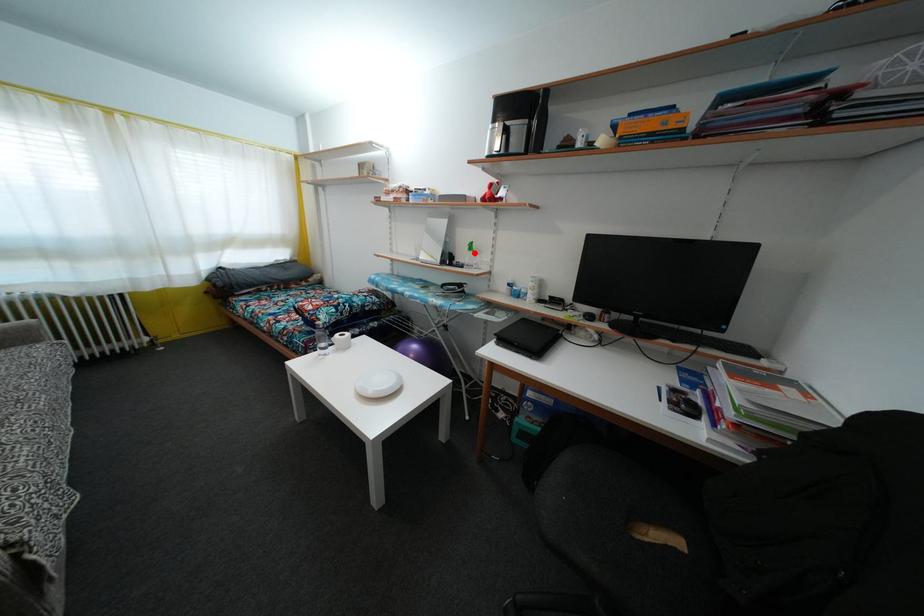
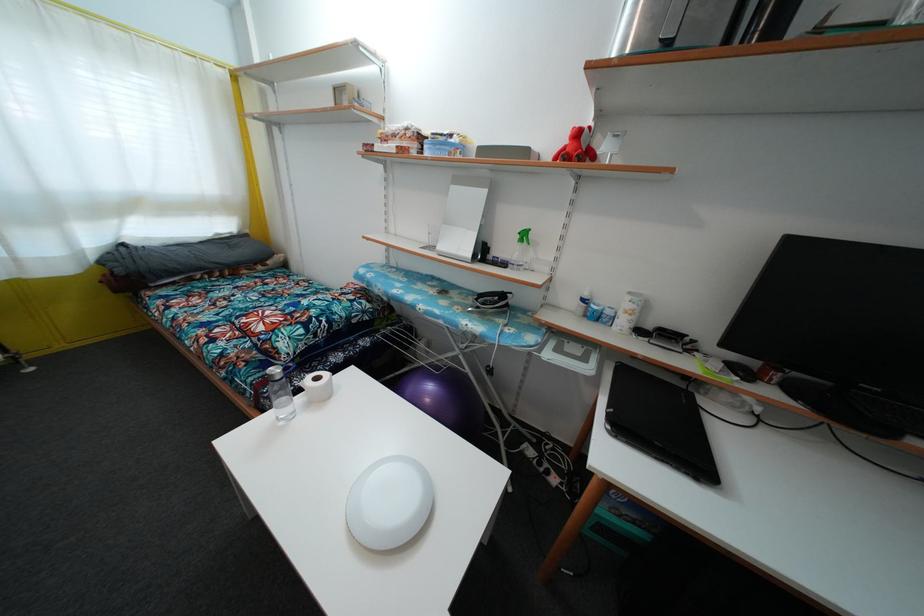
Locate, in the second image, the point that corresponds to the highlighted location in the first image.

(528, 241)